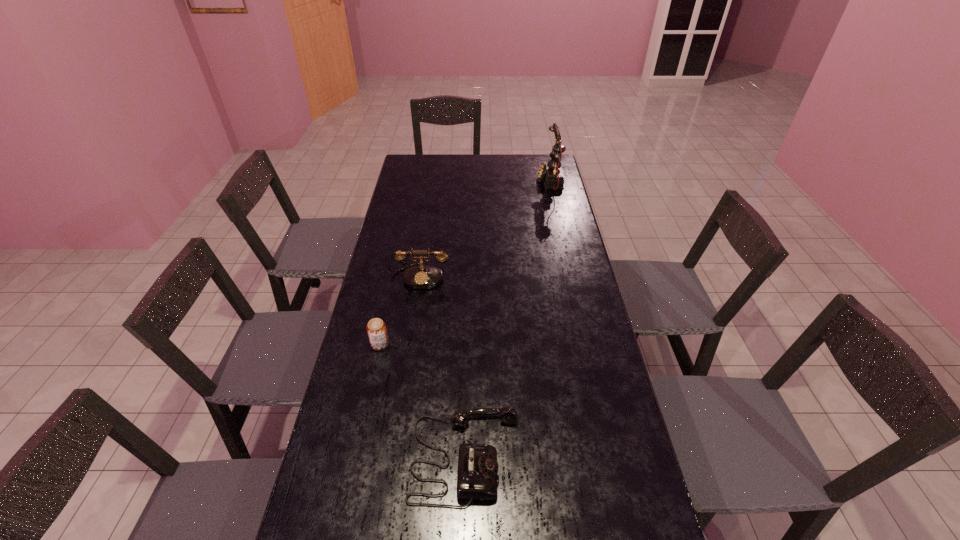
Identify the location of free point at the right edge. (577, 352).

In the image, there is a desktop. Identify the location of vacant region at the far left corner. (432, 161).

At what (x,y) coordinates should I click in order to perform the action: click on unoccupied area between the third farthest object and the tallest telephone. Please return your answer as a coordinate pair (x, y). The image size is (960, 540). Looking at the image, I should click on (465, 262).

This screenshot has width=960, height=540. Identify the location of free point between the farthest object and the second nearest object. (465, 262).

Identify the location of vacant space that is in between the third farthest object and the second farthest object. This screenshot has height=540, width=960. (400, 310).

Locate an element on the screen. The image size is (960, 540). unoccupied area between the nearest object and the second nearest object is located at coordinates (422, 400).

This screenshot has width=960, height=540. In order to click on vacant space in between the second shortest telephone and the shortest telephone in this screenshot , I will do `click(443, 366)`.

You are a GUI agent. You are given a task and a screenshot of the screen. Output one action in this format:
    pyautogui.click(x=<x>, y=<y>)
    Task: Click on the empty space between the third farthest object and the second tallest telephone
    The height and width of the screenshot is (540, 960).
    Given the screenshot: What is the action you would take?
    pyautogui.click(x=400, y=310)

Locate an element on the screen. The height and width of the screenshot is (540, 960). free space between the nearest object and the third farthest object is located at coordinates (422, 400).

This screenshot has width=960, height=540. I want to click on empty location between the second tallest telephone and the nearest telephone, so click(x=443, y=366).